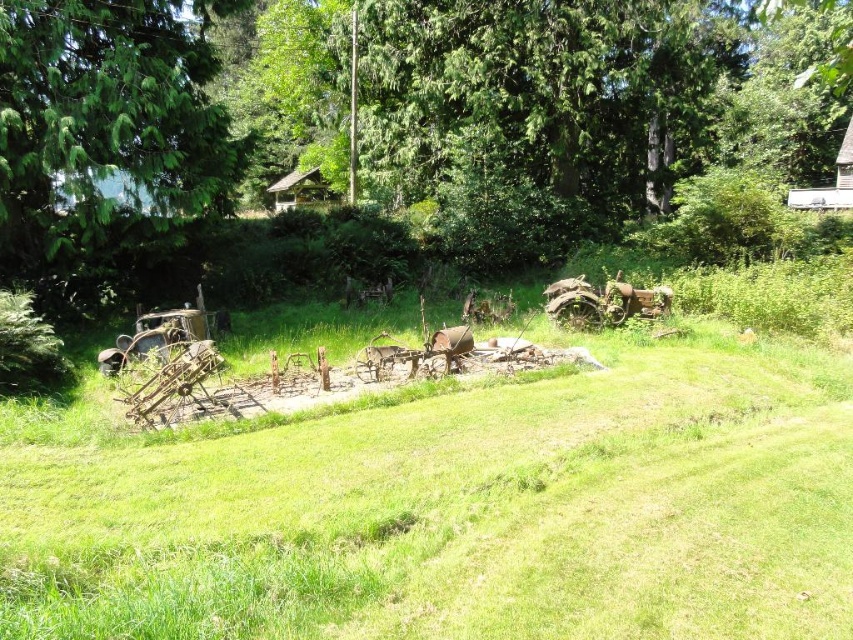
Does green leafy tree at center have a smaller size compared to wooden hut at upper right?

Incorrect, green leafy tree at center is not smaller in size than wooden hut at upper right.

Which is more to the left, green leafy tree at center or wooden hut at upper right?

green leafy tree at center

I want to click on green leafy tree at center, so click(401, 136).

Does green leafy tree at center lie in front of wooden hut at center?

That is True.

Find the location of a particular element. This screenshot has height=640, width=853. green leafy tree at center is located at coordinates (401, 136).

Which is more to the left, green textured tree at left or wooden hut at upper right?

green textured tree at left

Is green textured tree at left in front of wooden hut at upper right?

Yes, it is in front of wooden hut at upper right.

Identify the location of green textured tree at left. (109, 148).